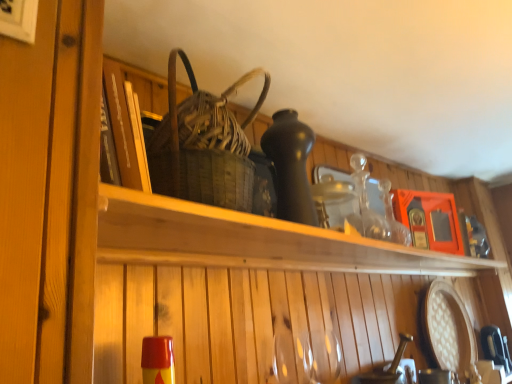
At what (x,y) coordinates should I click in order to perform the action: click on wooden shelf at center. Please return your answer as a coordinate pair (x, y). The height and width of the screenshot is (384, 512). Looking at the image, I should click on (251, 240).

The image size is (512, 384). What do you see at coordinates (251, 240) in the screenshot?
I see `wooden shelf at center` at bounding box center [251, 240].

Identify the location of wooden shelf at center. click(251, 240).